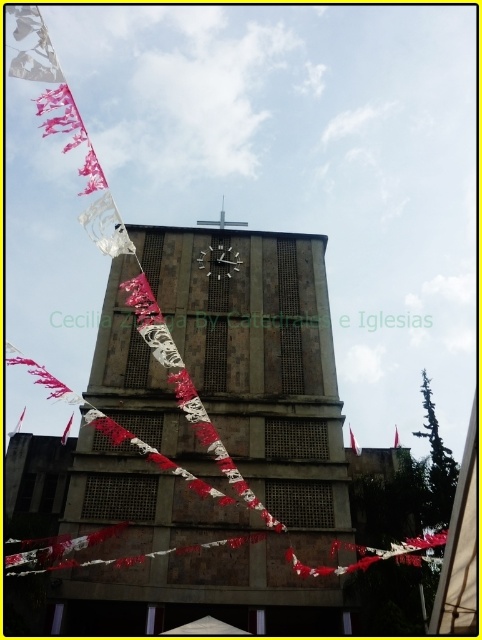
You are standing in front of the church and want to take a photo that includes both the brown textured stone clock tower at center and the metallic clock at center. Which object should you focus on first to ensure both are in frame?

You should focus on the brown textured stone clock tower at center first because it is larger in size than the metallic clock at center, so it will require more space in the frame.

You are standing in front of the church and want to take a photo of the brown textured stone clock tower at center and the white fabric flag at upper center. Which object will appear larger in the photo?

The brown textured stone clock tower at center will appear larger in the photo because it is closer to the viewer than the white fabric flag at upper center.